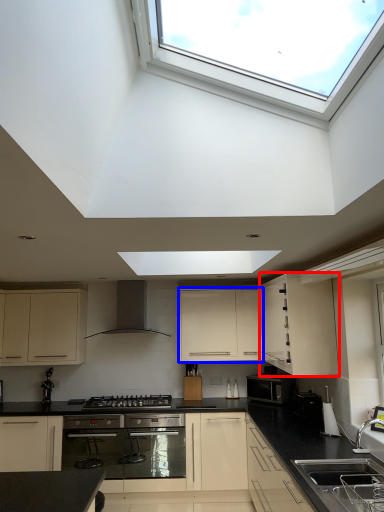
Question: Among these objects, which one is farthest to the camera, cabinetry (highlighted by a red box) or cabinetry (highlighted by a blue box)?

Choices:
 (A) cabinetry
 (B) cabinetry

Answer: (B)